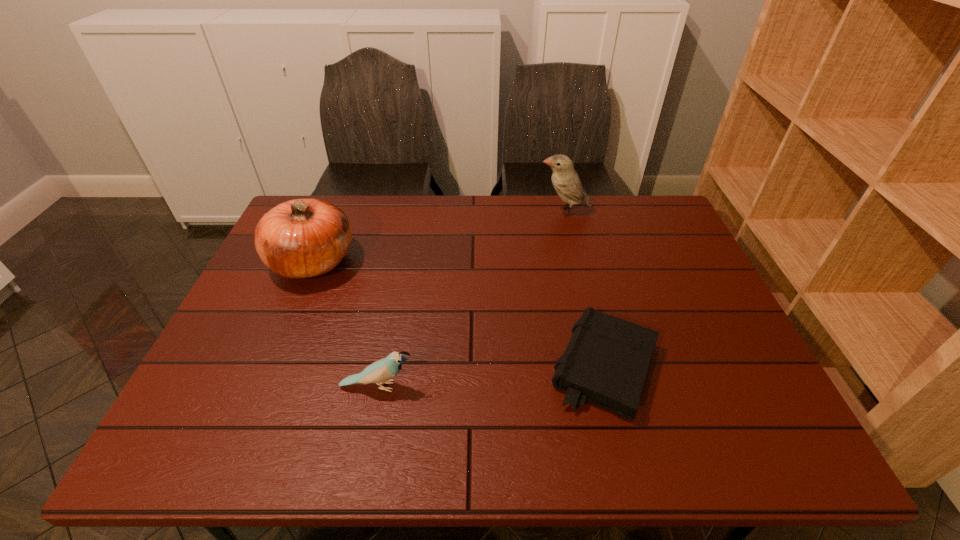
This screenshot has height=540, width=960. What are the coordinates of `free spot between the farthest object and the pumpkin` in the screenshot? It's located at (439, 237).

Locate an element on the screen. The height and width of the screenshot is (540, 960). free point between the second farthest object and the farther bird is located at coordinates (439, 237).

Identify the location of vacant region between the Bible and the farther bird. (584, 289).

You are a GUI agent. You are given a task and a screenshot of the screen. Output one action in this format:
    pyautogui.click(x=<x>, y=<y>)
    Task: Click on the closest object to the Bible
    The height and width of the screenshot is (540, 960).
    Given the screenshot: What is the action you would take?
    pyautogui.click(x=380, y=372)

This screenshot has width=960, height=540. I want to click on the second closest object to the Bible, so click(565, 180).

Find the location of a particular element. vacant space that satisfies the following two spatial constraints: 1. at the face of the taller bird; 2. on the front side of the third nearest object is located at coordinates coord(577,261).

The width and height of the screenshot is (960, 540). I want to click on vacant region that satisfies the following two spatial constraints: 1. on the front side of the Bible; 2. at the face of the nearer bird, so click(x=609, y=387).